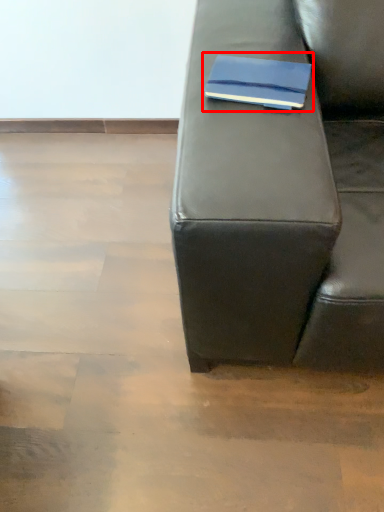
Question: Where is paperback book (annotated by the red box) located in relation to studio couch in the image?

Choices:
 (A) right
 (B) left

Answer: (A)